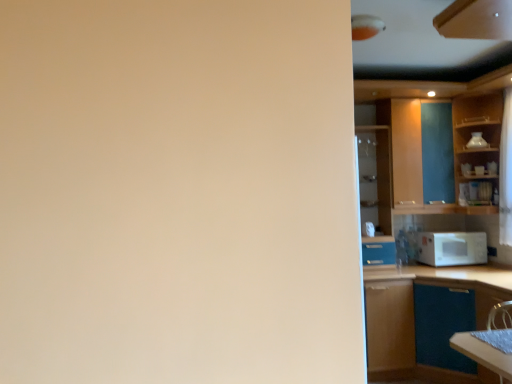
Question: Is white sheer curtain at right at the left side of matte glass cabinet at right, arranged as the 5th cabinetry when viewed from the front?

Choices:
 (A) yes
 (B) no

Answer: (B)

Question: Is white sheer curtain at right aimed at matte glass cabinet at right, arranged as the 5th cabinetry when viewed from the front?

Choices:
 (A) no
 (B) yes

Answer: (A)

Question: Are white sheer curtain at right and matte glass cabinet at right, arranged as the first cabinetry when viewed from the back, making contact?

Choices:
 (A) yes
 (B) no

Answer: (B)

Question: Is white sheer curtain at right at the right side of matte glass cabinet at right, arranged as the first cabinetry when viewed from the back?

Choices:
 (A) yes
 (B) no

Answer: (A)

Question: From the image's perspective, is white sheer curtain at right on top of matte glass cabinet at right, arranged as the 5th cabinetry when viewed from the front?

Choices:
 (A) yes
 (B) no

Answer: (A)

Question: Looking at the image, does white matte microwave at right seem bigger or smaller compared to matte glass cabinet at right, arranged as the first cabinetry when viewed from the back?

Choices:
 (A) small
 (B) big

Answer: (A)

Question: Is white matte microwave at right wider or thinner than matte glass cabinet at right, arranged as the first cabinetry when viewed from the back?

Choices:
 (A) thin
 (B) wide

Answer: (B)

Question: Is white matte microwave at right spatially inside matte glass cabinet at right, arranged as the 5th cabinetry when viewed from the front, or outside of it?

Choices:
 (A) inside
 (B) outside

Answer: (B)

Question: Is point (455, 246) positioned closer to the camera than point (369, 203)?

Choices:
 (A) farther
 (B) closer

Answer: (B)

Question: Considering the positions of point (384, 367) and point (452, 251), is point (384, 367) closer or farther from the camera than point (452, 251)?

Choices:
 (A) farther
 (B) closer

Answer: (B)

Question: In the image, is brown matte cabinet at right, placed as the third cabinetry when sorted from back to front, positioned in front of or behind white matte microwave at right?

Choices:
 (A) behind
 (B) front

Answer: (B)

Question: Looking at their shapes, would you say brown matte cabinet at right, the 3th cabinetry positioned from the front, is wider or thinner than white matte microwave at right?

Choices:
 (A) wide
 (B) thin

Answer: (A)

Question: From a real-world perspective, is brown matte cabinet at right, placed as the third cabinetry when sorted from back to front, positioned above or below white matte microwave at right?

Choices:
 (A) above
 (B) below

Answer: (B)

Question: Considering the relative positions of brown matte cabinet at right, the 3th cabinetry positioned from the front, and wooden cabinet at upper right, marked as the 5th cabinetry in a back-to-front arrangement, in the image provided, is brown matte cabinet at right, the 3th cabinetry positioned from the front, to the left or to the right of wooden cabinet at upper right, marked as the 5th cabinetry in a back-to-front arrangement,?

Choices:
 (A) right
 (B) left

Answer: (B)

Question: From their relative heights in the image, would you say brown matte cabinet at right, placed as the third cabinetry when sorted from back to front, is taller or shorter than wooden cabinet at upper right, marked as the 5th cabinetry in a back-to-front arrangement?

Choices:
 (A) tall
 (B) short

Answer: (A)